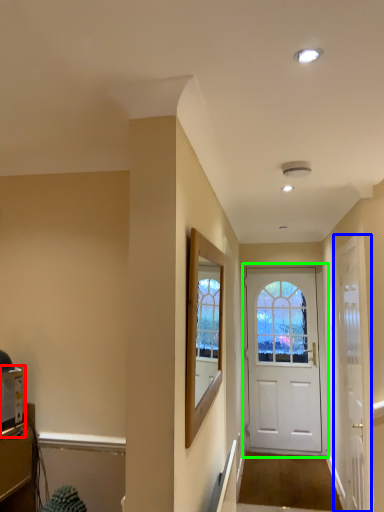
Question: Based on their relative distances, which object is farther from appliance (highlighted by a red box)? Choose from door (highlighted by a blue box) and door (highlighted by a green box).

Choices:
 (A) door
 (B) door

Answer: (B)